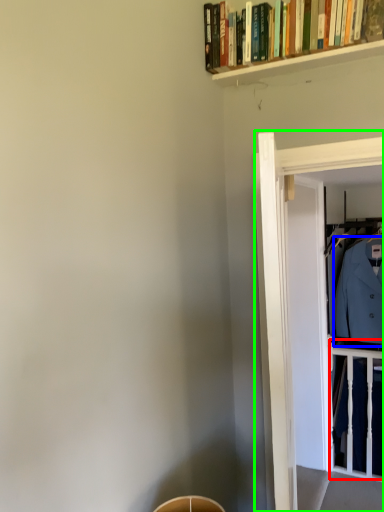
Question: Which object is positioned closest to balustrade (highlighted by a red box)? Select from dress shirt (highlighted by a blue box) and glass door (highlighted by a green box).

Choices:
 (A) dress shirt
 (B) glass door

Answer: (A)